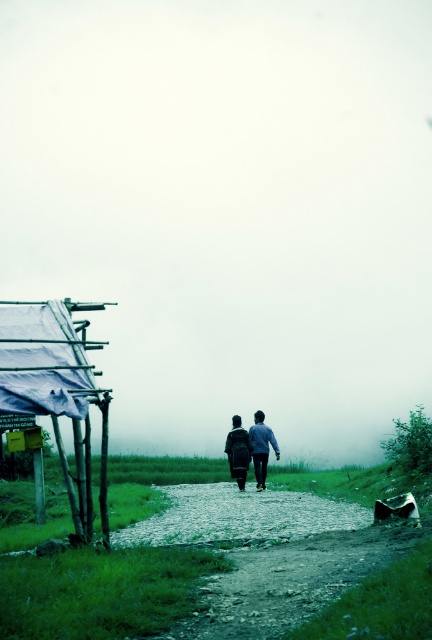
Who is positioned more to the right, matte black backpack at center or dark blue fabric jacket at center?

Positioned to the right is matte black backpack at center.

In order to click on matte black backpack at center in this screenshot , I will do `click(250, 449)`.